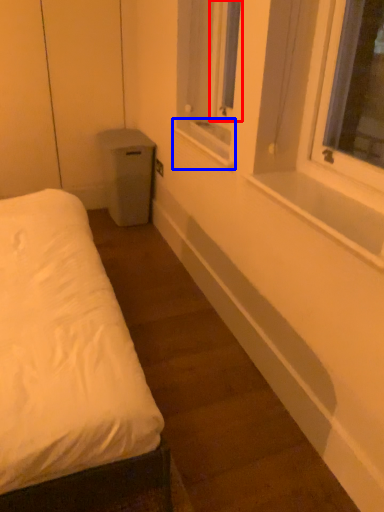
Question: Among these objects, which one is farthest to the camera, window screen (highlighted by a red box) or window sill (highlighted by a blue box)?

Choices:
 (A) window screen
 (B) window sill

Answer: (A)